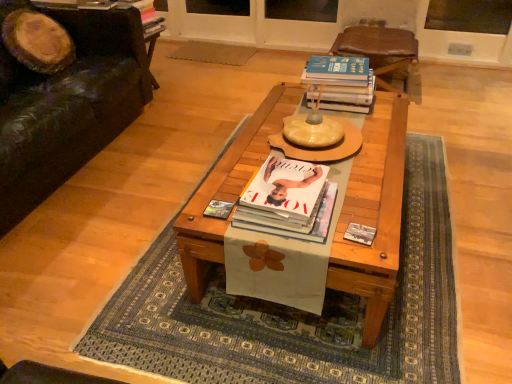
The height and width of the screenshot is (384, 512). I want to click on vacant point to the right of matte yellow round table at center, so [x=382, y=138].